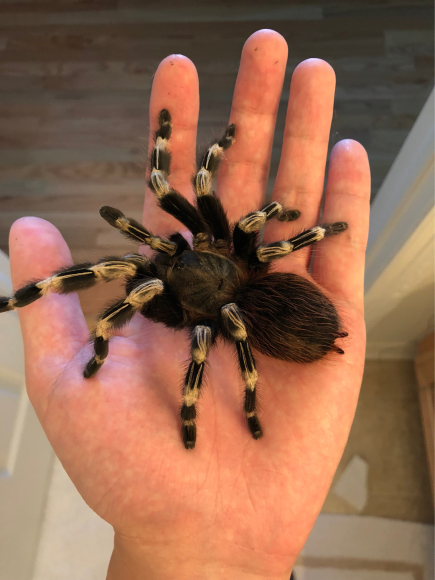
Identify the location of floor. Image resolution: width=435 pixels, height=580 pixels. (106, 94), (384, 433).